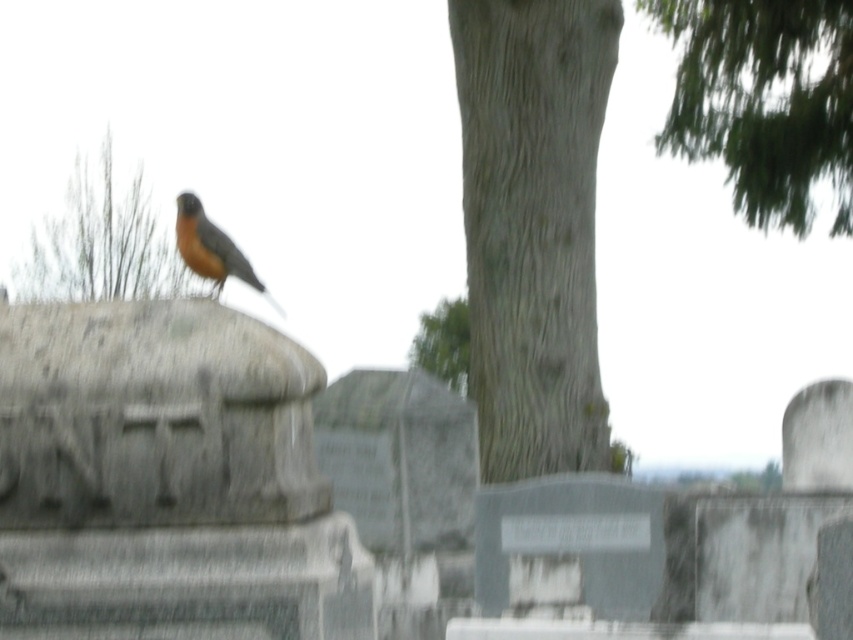
You are standing in a cemetery and want to take a photo of the two points marked in the image. Which point, point (756,48) or point (225,244), is closer to the camera?

Point (225,244) is closer to the camera than point (756,48).

You are standing in a cemetery and see the gray textured tree trunk at center and the brown textured tree trunk at upper center. Which tree trunk is taller?

The gray textured tree trunk at center is much taller than the brown textured tree trunk at upper center.

You are a bird flying over a cemetery and want to land on a tree. You see the gray textured tree trunk at center and the green leafy tree at upper right. Which tree is closer to your current position if you are above the gravestone where the bird is perched?

The gray textured tree trunk at center is closer to your current position because it is positioned on the left side of the green leafy tree at upper right, meaning it is nearer to the gravestone where you are flying above.